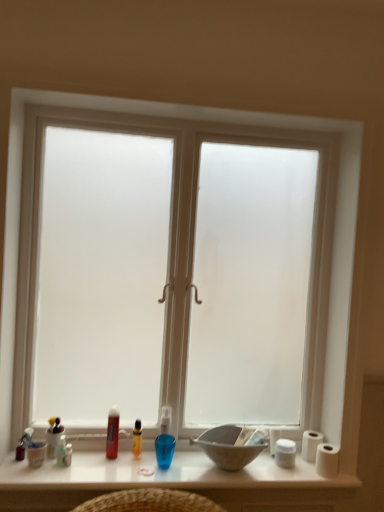
Identify the location of vacant space to the right of translucent plastic bottle at lower left, which appears as the third toiletry when viewed from the right. (106, 466).